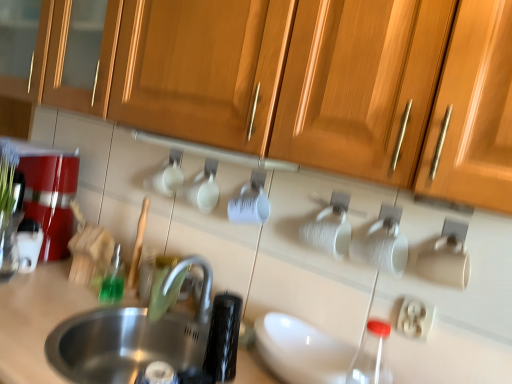
Question: From a real-world perspective, is metallic red coffee machine at left positioned over green translucent bottle at left based on gravity?

Choices:
 (A) no
 (B) yes

Answer: (B)

Question: Is the depth of metallic red coffee machine at left less than that of green translucent bottle at left?

Choices:
 (A) no
 (B) yes

Answer: (A)

Question: Could green translucent bottle at left be considered to be inside metallic red coffee machine at left?

Choices:
 (A) no
 (B) yes

Answer: (A)

Question: Considering the relative sizes of metallic red coffee machine at left and green translucent bottle at left in the image provided, is metallic red coffee machine at left shorter than green translucent bottle at left?

Choices:
 (A) yes
 (B) no

Answer: (B)

Question: Does metallic red coffee machine at left have a larger size compared to green translucent bottle at left?

Choices:
 (A) yes
 (B) no

Answer: (A)

Question: Is green translucent bottle at left inside the boundaries of stainless steel sink at lower left, or outside?

Choices:
 (A) inside
 (B) outside

Answer: (B)

Question: Is point (112, 258) positioned closer to the camera than point (181, 367)?

Choices:
 (A) farther
 (B) closer

Answer: (A)

Question: From their relative heights in the image, would you say green translucent bottle at left is taller or shorter than stainless steel sink at lower left?

Choices:
 (A) short
 (B) tall

Answer: (A)

Question: In terms of width, does green translucent bottle at left look wider or thinner when compared to stainless steel sink at lower left?

Choices:
 (A) thin
 (B) wide

Answer: (A)

Question: Looking at the image, does wooden cabinet at upper center seem bigger or smaller compared to white plastic electric outlet at lower right?

Choices:
 (A) big
 (B) small

Answer: (A)

Question: From a real-world perspective, is wooden cabinet at upper center physically located above or below white plastic electric outlet at lower right?

Choices:
 (A) above
 (B) below

Answer: (A)

Question: Relative to white plastic electric outlet at lower right, is wooden cabinet at upper center in front or behind?

Choices:
 (A) front
 (B) behind

Answer: (A)

Question: Visually, is wooden cabinet at upper center positioned to the left or to the right of white plastic electric outlet at lower right?

Choices:
 (A) left
 (B) right

Answer: (A)

Question: In terms of size, does stainless steel sink at lower left appear bigger or smaller than metallic red coffee machine at left?

Choices:
 (A) big
 (B) small

Answer: (B)

Question: Is stainless steel sink at lower left situated inside metallic red coffee machine at left or outside?

Choices:
 (A) outside
 (B) inside

Answer: (A)